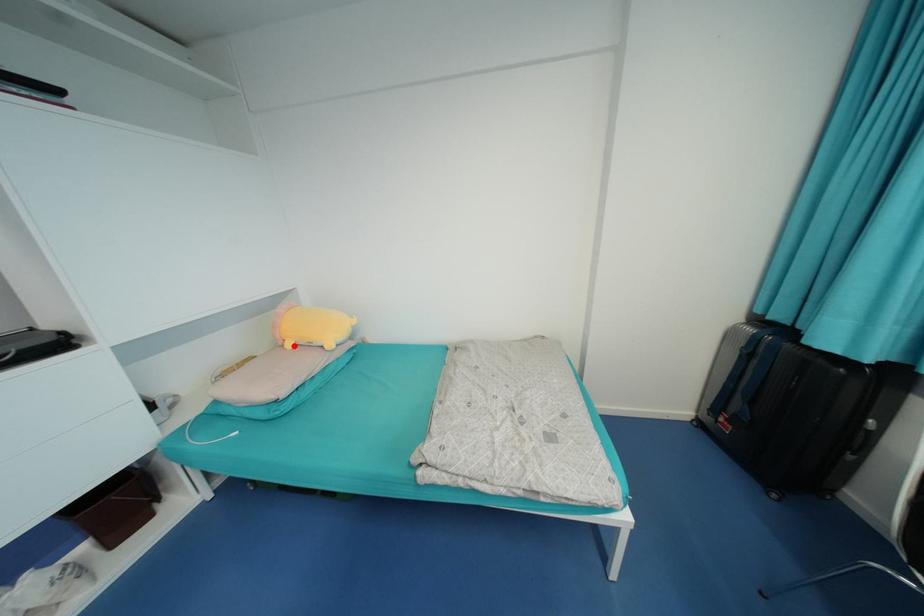
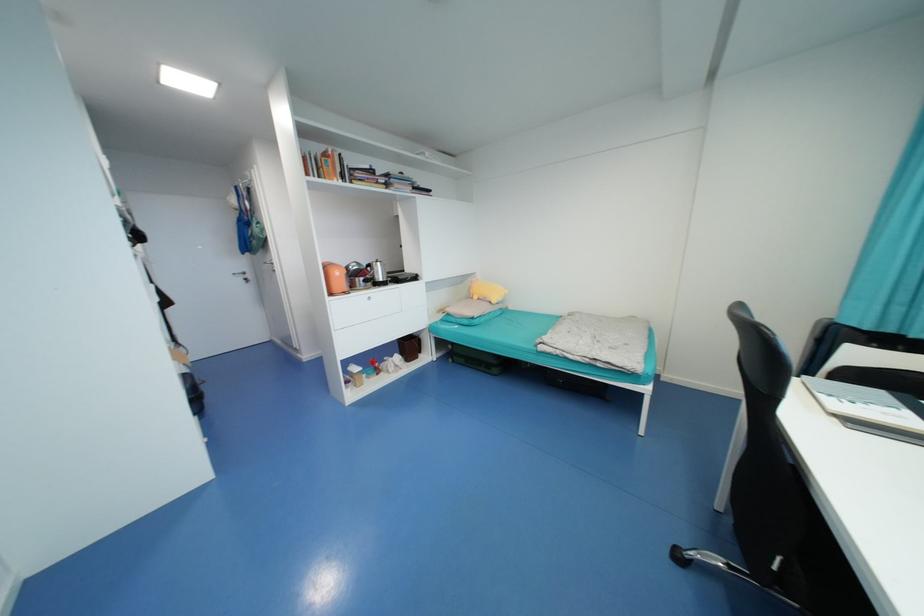
Locate, in the second image, the point that corresponds to the highlighted location in the first image.

(480, 299)